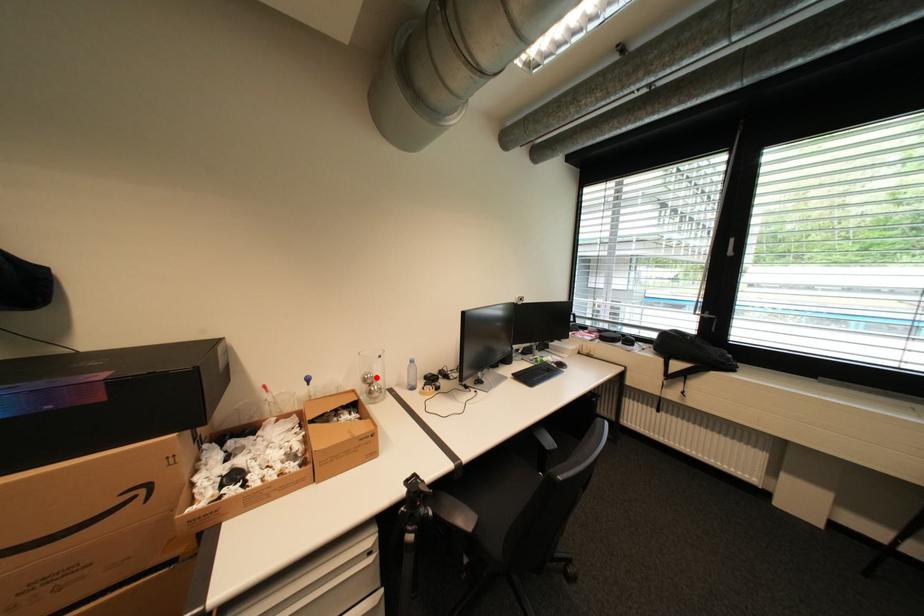
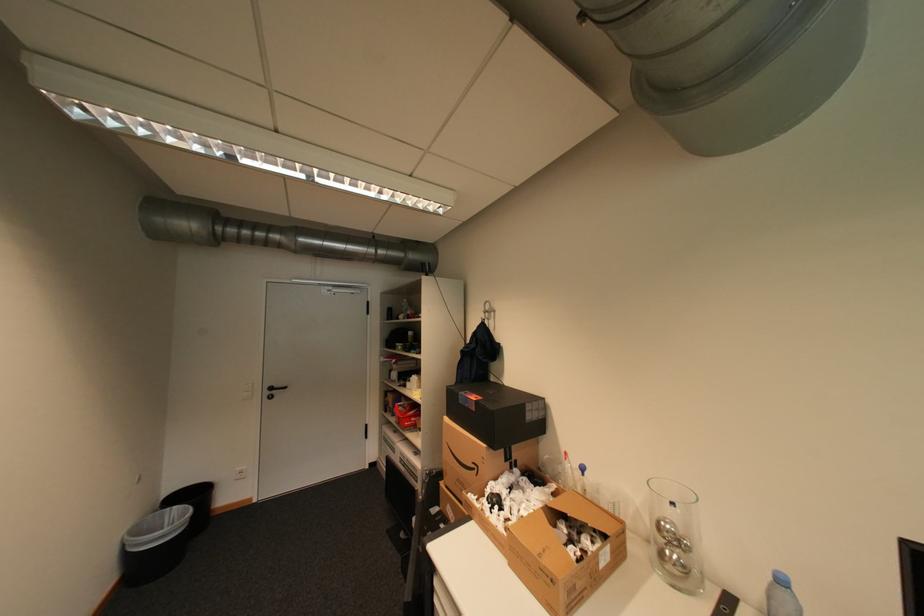
In the second image, find the point that corresponds to the highlighted location in the first image.

(673, 527)